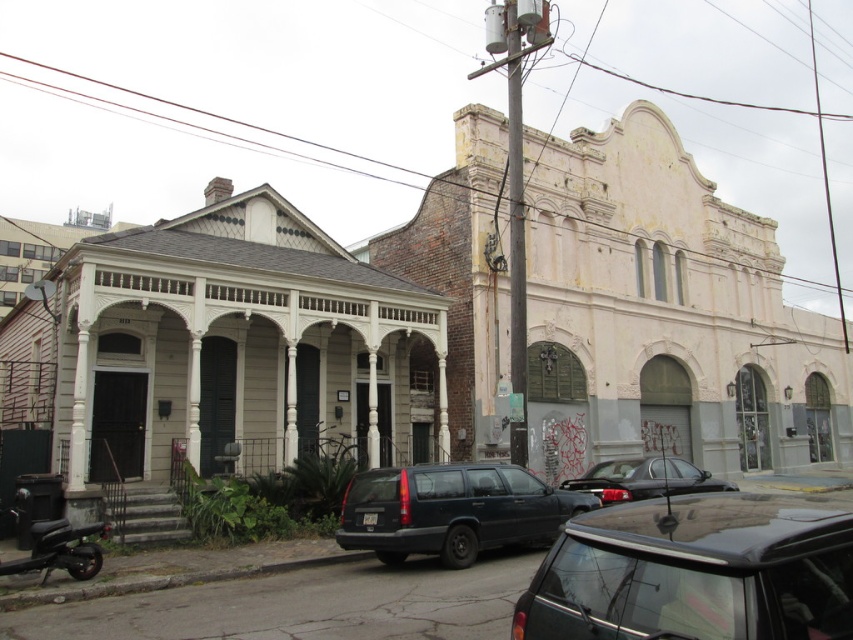
You are a delivery person needing to park your shiny black suv at center and shiny black scooter at lower left in this street scene. According to the image, where should you place each vehicle so they don not block the entrance of the traditional house on the left?

The shiny black suv at center should be parked below the shiny black scooter at lower left to avoid blocking the entrance of the traditional house on the left.

You are a delivery person who needs to park your shiny black suv at center and shiny black scooter at lower left on the street. The street has a no parking zone marked in the middle. Where should you park each vehicle to avoid the no parking zone?

The shiny black suv at center should be parked to the right of the no parking zone, and the shiny black scooter at lower left should be parked to the left of the no parking zone since the suv is already positioned to the right of the scooter, indicating the no parking zone is between them.

You are a photographer standing at the center of the street. You want to take a photo that includes both the traditional house on the left and the older building on the right. However, your camera has a limited depth of field and can only focus on objects at a certain distance. Which of the two points, point (734, 552) or point (463, 480), should you focus on to ensure that the closest object in the scene is in sharp focus?

You should focus on point (734, 552) because it is closer to the camera than point (463, 480). By focusing on the closer point, the depth of field will extend backward, keeping both points in acceptable focus while prioritizing the nearer one.